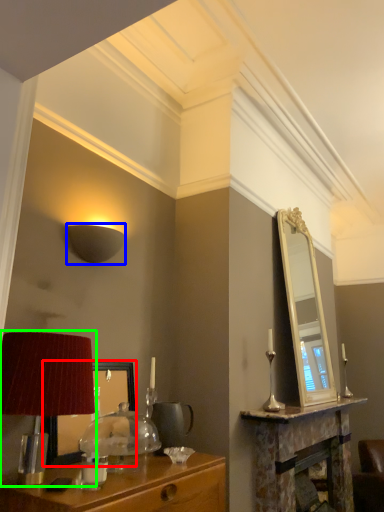
Question: Based on their relative distances, which object is farther from mirror (highlighted by a red box)? Choose from lamp (highlighted by a blue box) and table lamp (highlighted by a green box).

Choices:
 (A) lamp
 (B) table lamp

Answer: (A)